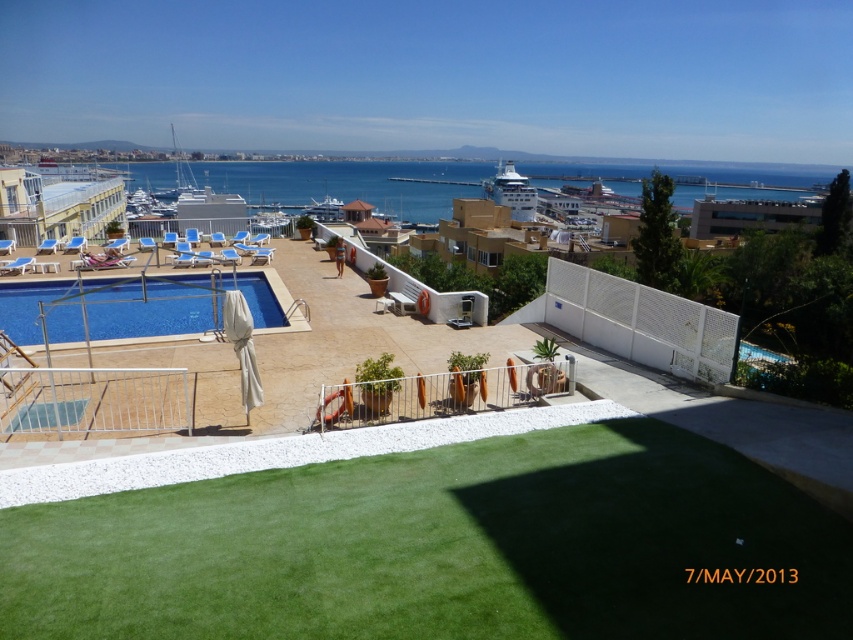
Can you confirm if white glossy building at left is thinner than white glossy cruise ship at center?

In fact, white glossy building at left might be wider than white glossy cruise ship at center.

The width and height of the screenshot is (853, 640). What do you see at coordinates (57, 204) in the screenshot?
I see `white glossy building at left` at bounding box center [57, 204].

I want to click on white glossy building at left, so click(57, 204).

You are a GUI agent. You are given a task and a screenshot of the screen. Output one action in this format:
    pyautogui.click(x=<x>, y=<y>)
    Task: Click on the blue water at center
    
    Given the screenshot: What is the action you would take?
    pyautogui.click(x=351, y=182)

Looking at this image, can you confirm if blue water at center is positioned to the left of white glossy cruise ship at center?

In fact, blue water at center is to the right of white glossy cruise ship at center.

Locate an element on the screen. The width and height of the screenshot is (853, 640). blue water at center is located at coordinates 351,182.

Does blue water at center have a smaller size compared to blue glossy pool at lower left?

No, blue water at center is not smaller than blue glossy pool at lower left.

Does blue water at center appear on the right side of blue glossy pool at lower left?

Yes, blue water at center is to the right of blue glossy pool at lower left.

Does point (337, 184) come closer to viewer compared to point (260, 276)?

That is False.

The image size is (853, 640). Identify the location of blue water at center. (351, 182).